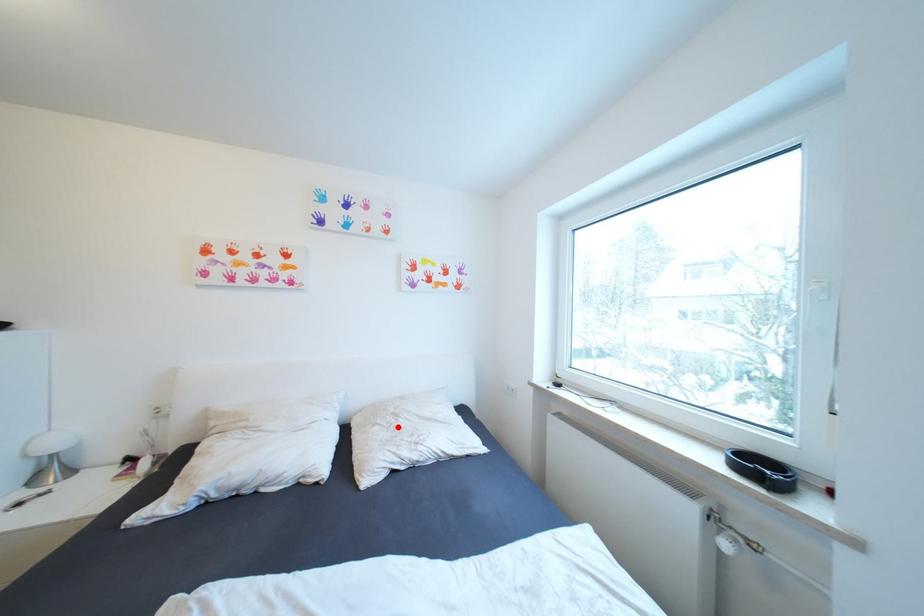
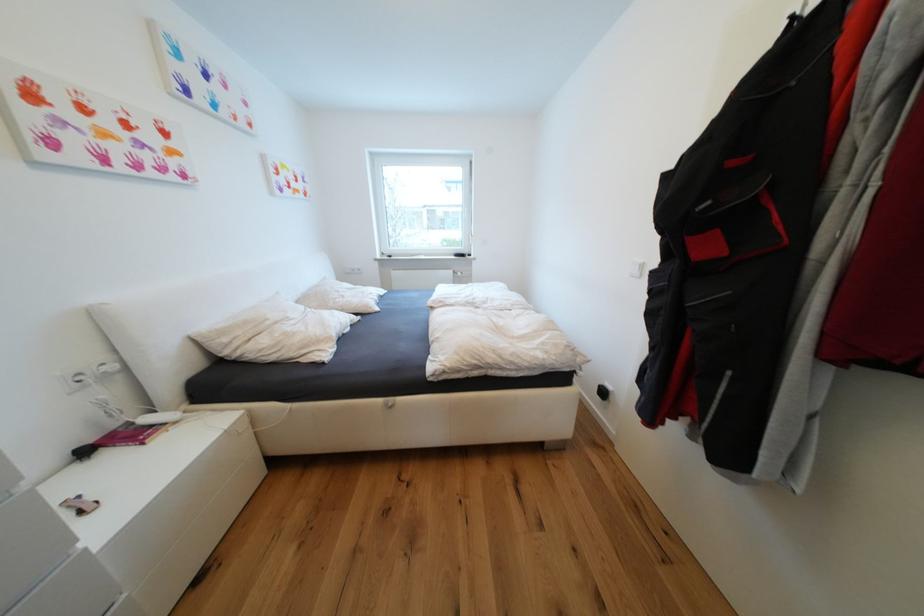
In the second image, find the point that corresponds to the highlighted location in the first image.

(349, 297)